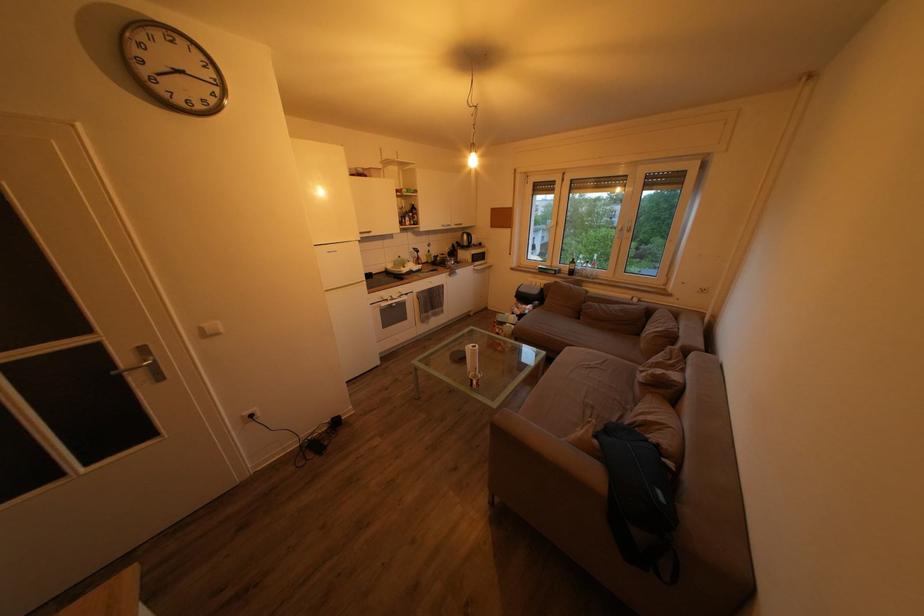
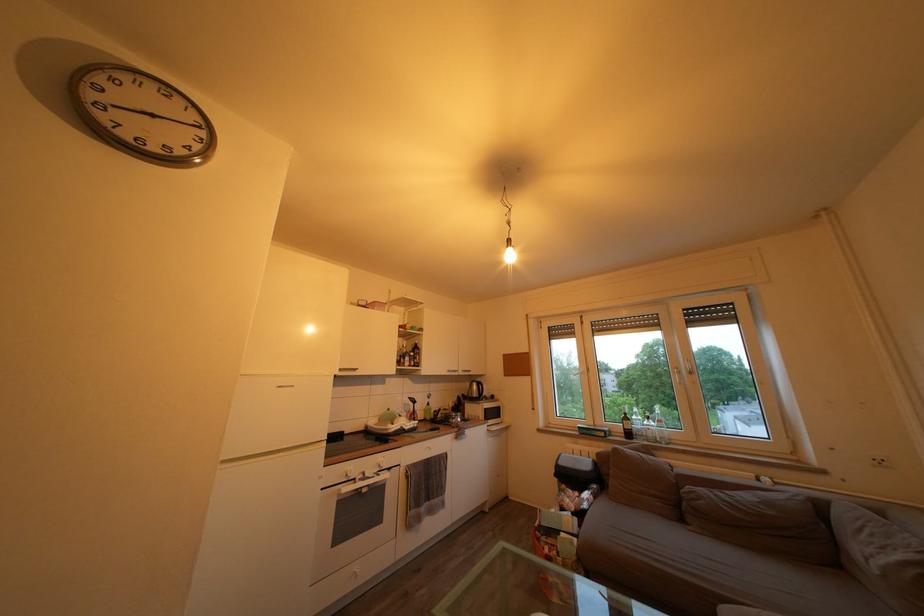
Locate, in the second image, the point that corresponds to (x=711, y=297) in the first image.

(889, 468)